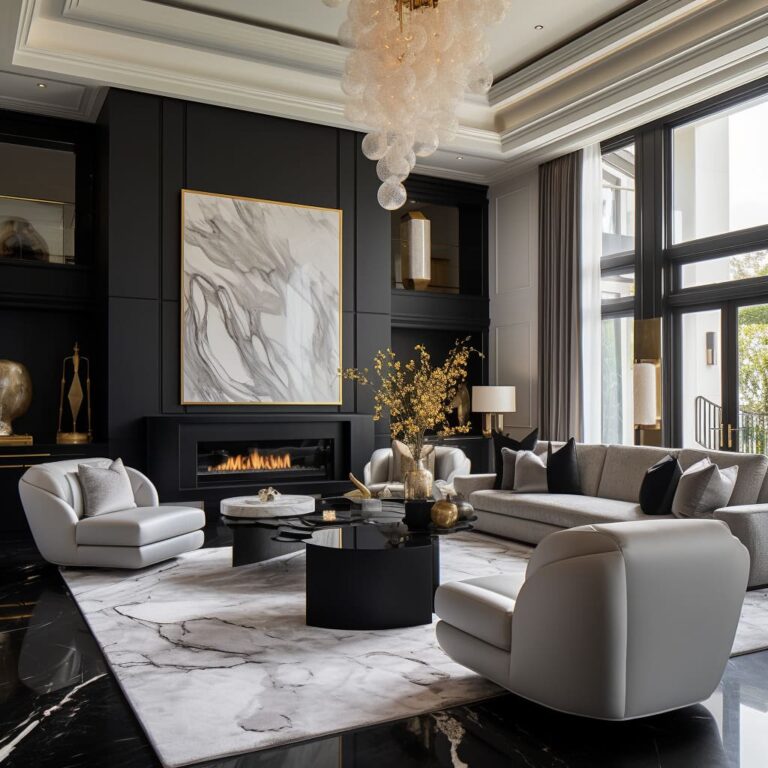
This screenshot has width=768, height=768. In order to click on chandelier in this screenshot , I will do 389,80.